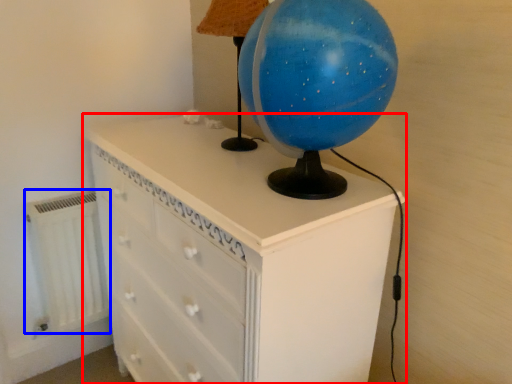
Question: Which object is closer to the camera taking this photo, chest of drawers (highlighted by a red box) or radiator (highlighted by a blue box)?

Choices:
 (A) chest of drawers
 (B) radiator

Answer: (A)